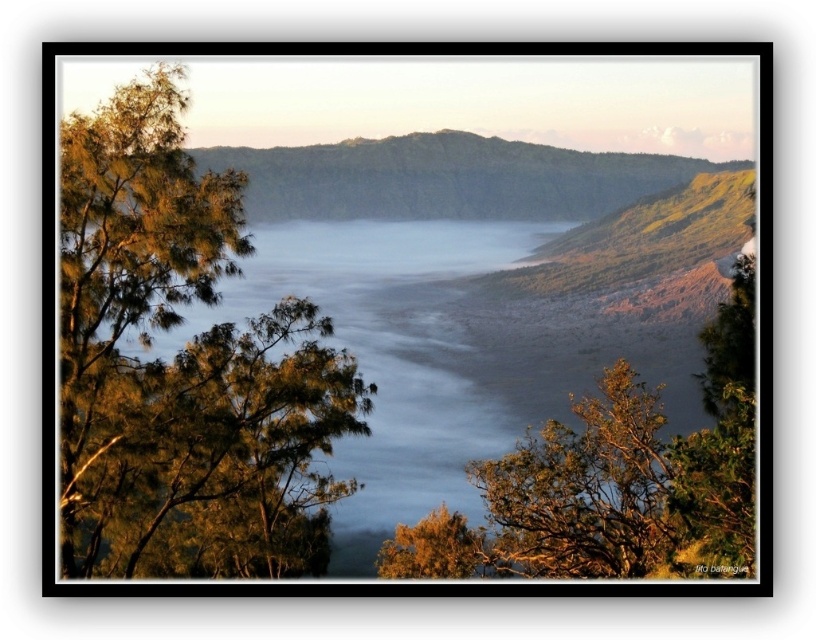
Question: Is green leafy tree at left closer to the viewer compared to green grassy hill at center?

Choices:
 (A) no
 (B) yes

Answer: (B)

Question: Estimate the real-world distances between objects in this image. Which object is farther from the green leafy tree at lower center?

Choices:
 (A) green grassy hill at center
 (B) green leafy tree at left

Answer: (A)

Question: Which point is closer to the camera taking this photo?

Choices:
 (A) (74, 189)
 (B) (329, 211)
 (C) (442, 548)

Answer: (A)

Question: Is green leafy tree at left to the right of green leafy tree at lower center from the viewer's perspective?

Choices:
 (A) yes
 (B) no

Answer: (B)

Question: Which object is positioned farthest from the green leafy tree at left?

Choices:
 (A) green leafy tree at lower center
 (B) green grassy hill at center

Answer: (B)

Question: Is green leafy tree at left to the right of green grassy hill at center from the viewer's perspective?

Choices:
 (A) yes
 (B) no

Answer: (B)